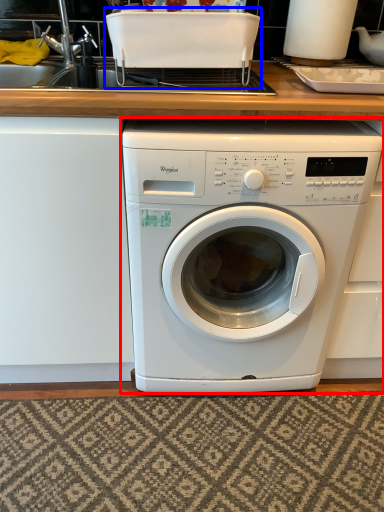
Question: Which of the following is the farthest to the observer, washing machine (highlighted by a red box) or appliance (highlighted by a blue box)?

Choices:
 (A) washing machine
 (B) appliance

Answer: (B)